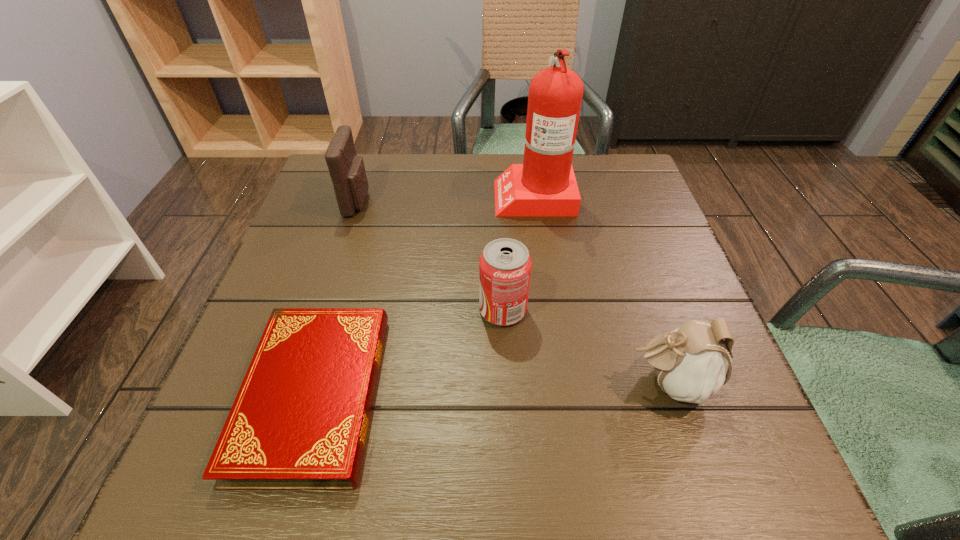
I want to click on object that is at the far left corner, so click(347, 171).

Where is `object that is at the near left corner`? object that is at the near left corner is located at coordinates (300, 419).

This screenshot has width=960, height=540. What are the coordinates of `vacant space at the far edge of the desktop` in the screenshot? It's located at (430, 163).

I want to click on vacant space at the near edge of the desktop, so click(x=620, y=451).

Locate an element on the screen. This screenshot has width=960, height=540. vacant space at the left edge is located at coordinates (217, 413).

The height and width of the screenshot is (540, 960). What are the coordinates of `vacant space at the right edge of the desktop` in the screenshot? It's located at (630, 240).

At what (x,y) coordinates should I click in order to perform the action: click on vacant space at the far left corner of the desktop. Please return your answer as a coordinate pair (x, y). The image size is (960, 540). Looking at the image, I should click on (329, 191).

Identify the location of vacant region at the near left corner. The image size is (960, 540). (283, 494).

Find the location of a particular element. This screenshot has width=960, height=540. vacant space at the far right corner of the desktop is located at coordinates (582, 187).

Find the location of a particular element. The height and width of the screenshot is (540, 960). vacant space at the near right corner of the desktop is located at coordinates (735, 481).